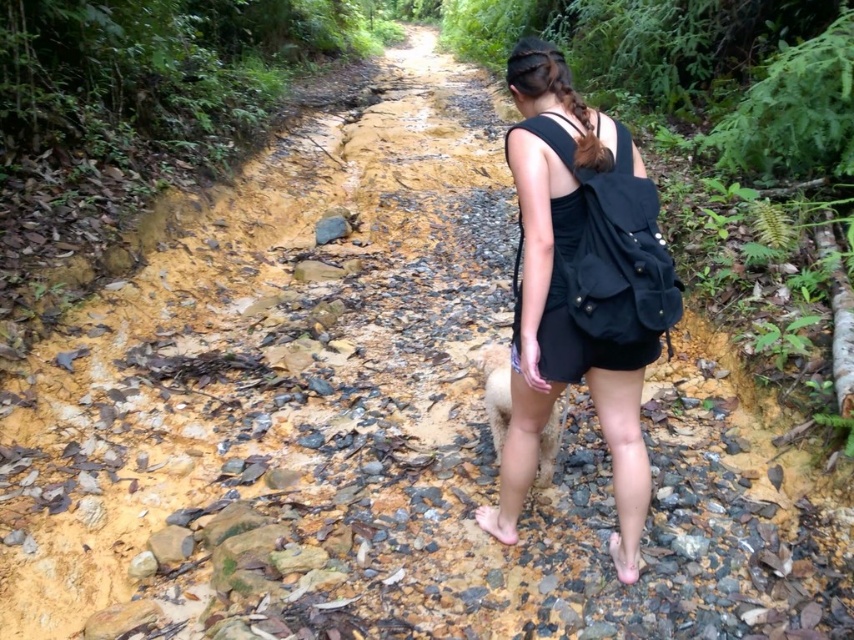
Who is more distant from viewer, (506, 452) or (615, 566)?

Positioned behind is point (506, 452).

Who is higher up, black fabric backpack at center or pink fabric sandal at lower center?

black fabric backpack at center is higher up.

The height and width of the screenshot is (640, 854). Identify the location of black fabric backpack at center. [578, 280].